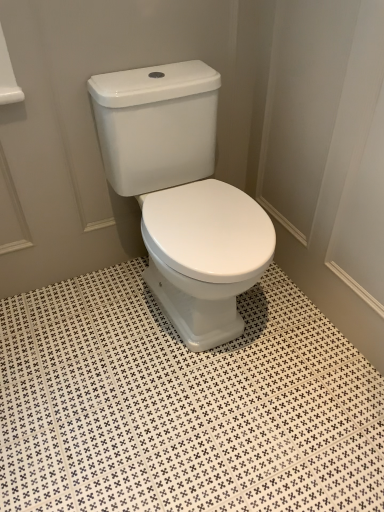
Question: Is white glossy ceramic tile at center taller than white glossy toilet at center?

Choices:
 (A) yes
 (B) no

Answer: (B)

Question: Is white glossy ceramic tile at center shorter than white glossy toilet at center?

Choices:
 (A) no
 (B) yes

Answer: (B)

Question: Considering the relative sizes of white glossy ceramic tile at center and white glossy toilet at center in the image provided, is white glossy ceramic tile at center smaller than white glossy toilet at center?

Choices:
 (A) yes
 (B) no

Answer: (A)

Question: Considering the relative sizes of white glossy ceramic tile at center and white glossy toilet at center in the image provided, is white glossy ceramic tile at center thinner than white glossy toilet at center?

Choices:
 (A) yes
 (B) no

Answer: (B)

Question: Is the position of white glossy ceramic tile at center less distant than that of white glossy toilet at center?

Choices:
 (A) no
 (B) yes

Answer: (B)

Question: Is white glossy ceramic tile at center at the left side of white glossy toilet at center?

Choices:
 (A) yes
 (B) no

Answer: (A)

Question: Could white glossy ceramic tile at center be considered to be inside white glossy toilet at center?

Choices:
 (A) yes
 (B) no

Answer: (B)

Question: Does white glossy toilet at center turn towards white glossy ceramic tile at center?

Choices:
 (A) no
 (B) yes

Answer: (A)

Question: Does white glossy toilet at center have a larger size compared to white glossy ceramic tile at center?

Choices:
 (A) no
 (B) yes

Answer: (B)

Question: Is there a large distance between white glossy toilet at center and white glossy ceramic tile at center?

Choices:
 (A) yes
 (B) no

Answer: (B)

Question: Can you confirm if white glossy toilet at center is thinner than white glossy ceramic tile at center?

Choices:
 (A) yes
 (B) no

Answer: (A)

Question: Does white glossy toilet at center have a smaller size compared to white glossy ceramic tile at center?

Choices:
 (A) no
 (B) yes

Answer: (A)

Question: From a real-world perspective, is white glossy ceramic tile at center physically located above or below white glossy toilet at center?

Choices:
 (A) above
 (B) below

Answer: (B)